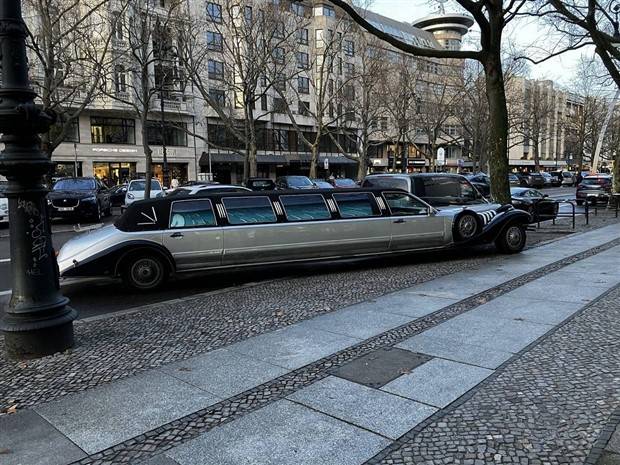
Where is `silver grate between windows`? The image size is (620, 465). silver grate between windows is located at coordinates (222, 213), (278, 209), (332, 207), (381, 206).